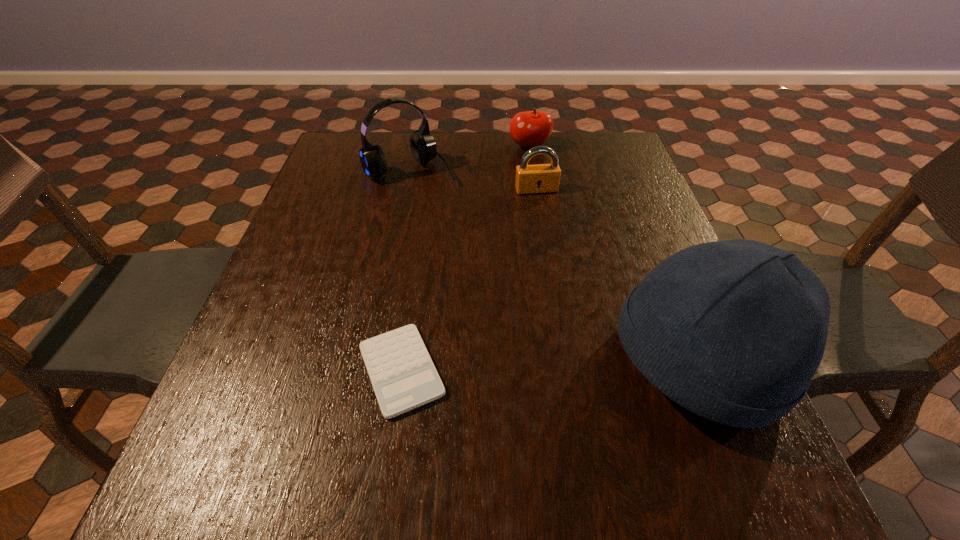
In the image, there is a desktop. Identify the location of free space at the far right corner. The height and width of the screenshot is (540, 960). (604, 144).

This screenshot has width=960, height=540. In order to click on free space that is in between the shortest object and the padlock in this screenshot , I will do coord(468,280).

At what (x,y) coordinates should I click in order to perform the action: click on vacant point located between the headset and the padlock. Please return your answer as a coordinate pair (x, y). The height and width of the screenshot is (540, 960). Looking at the image, I should click on (473, 180).

Find the location of a particular element. This screenshot has height=540, width=960. free space between the calculator and the skullcap is located at coordinates (549, 366).

Locate an element on the screen. free space that is in between the calculator and the apple is located at coordinates (466, 258).

Identify the location of vacant region between the padlock and the skullcap. (617, 276).

What are the coordinates of `blank region between the shortest object and the apple` in the screenshot? It's located at (466, 258).

Where is `free space that is in between the rightmost object and the apple`? free space that is in between the rightmost object and the apple is located at coordinates (613, 254).

Where is `free spot between the fourth shortest object and the rightmost object`? free spot between the fourth shortest object and the rightmost object is located at coordinates (554, 266).

The width and height of the screenshot is (960, 540). I want to click on free space between the shortest object and the padlock, so click(468, 280).